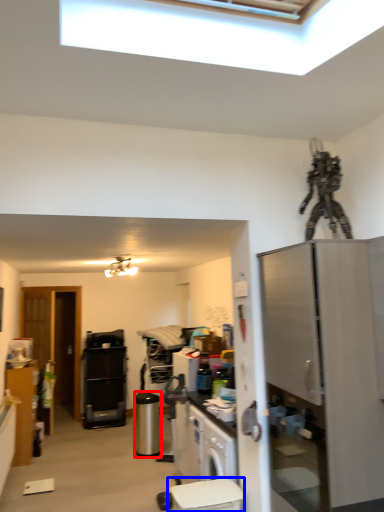
Question: Which of the following is the farthest to the observer, appliance (highlighted by a red box) or toilet bowl (highlighted by a blue box)?

Choices:
 (A) appliance
 (B) toilet bowl

Answer: (A)